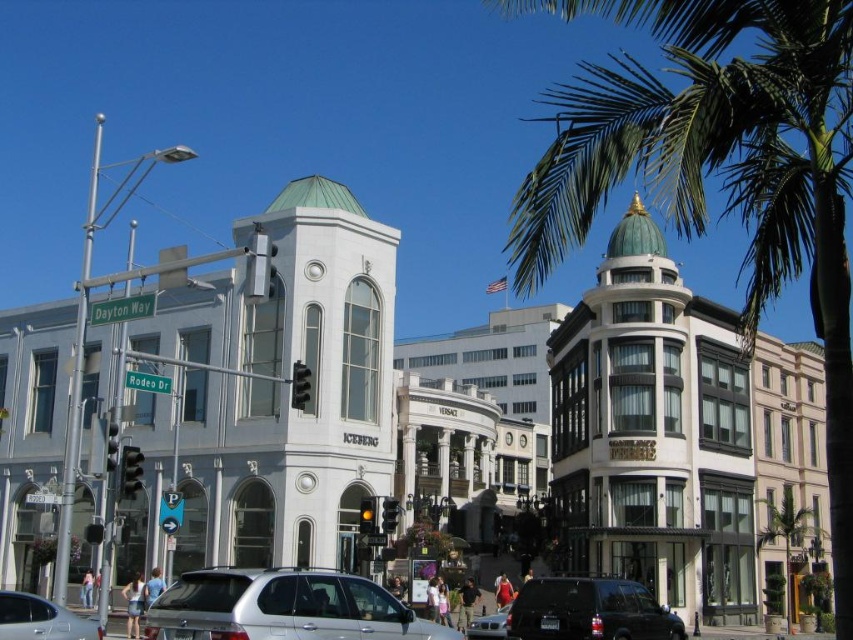
Question: Which object is the closest to the silver metallic suv at center?

Choices:
 (A) green leafy palm tree at upper right
 (B) silver metallic car at lower left
 (C) silver metallic sedan at center

Answer: (B)

Question: Does silver metallic suv at center come behind shiny black suv at lower center?

Choices:
 (A) yes
 (B) no

Answer: (B)

Question: Which of these objects is positioned farthest from the green leafy palm tree at center right?

Choices:
 (A) silver metallic car at lower left
 (B) shiny black suv at lower center
 (C) silver metallic suv at center
 (D) silver metallic sedan at center

Answer: (A)

Question: Considering the real-world distances, which object is farthest from the silver metallic suv at center?

Choices:
 (A) silver metallic car at lower left
 (B) shiny black suv at lower center
 (C) green leafy palm tree at center right
 (D) silver metallic sedan at center

Answer: (C)

Question: Is green leafy palm tree at upper right above shiny black suv at lower center?

Choices:
 (A) yes
 (B) no

Answer: (A)

Question: Is silver metallic suv at center smaller than shiny black suv at lower center?

Choices:
 (A) no
 (B) yes

Answer: (A)